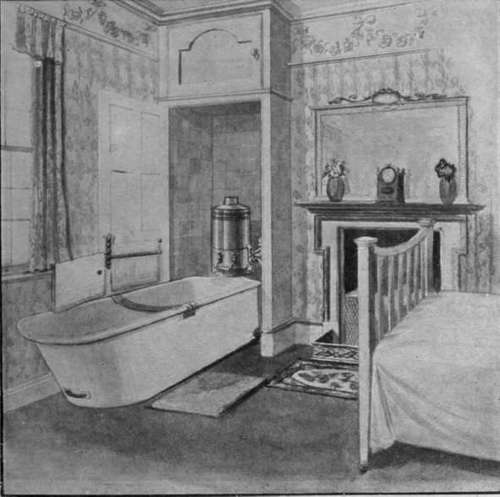
Identify the location of window. This screenshot has height=497, width=500. (19, 180).